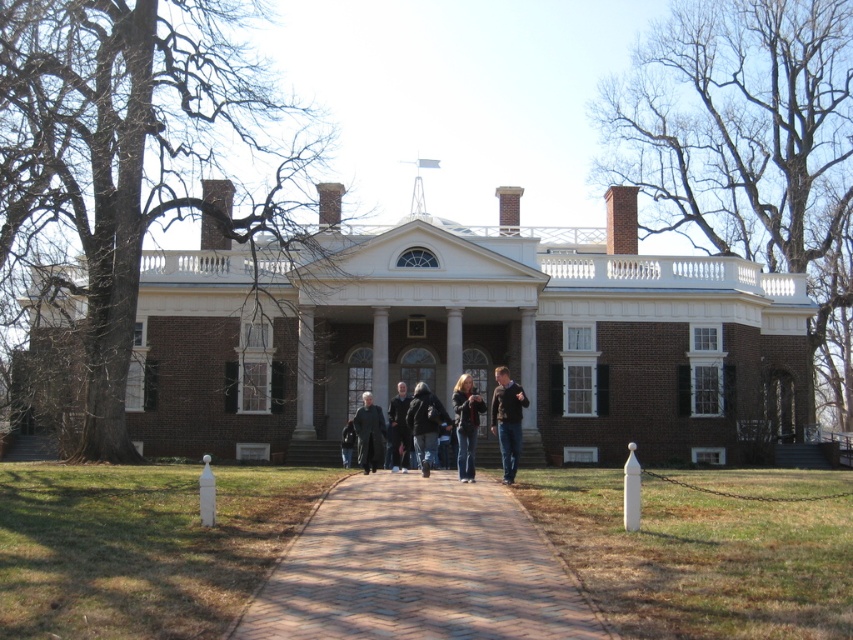
Is brick paved walkway at center above dark gray sweater at center?

Incorrect, brick paved walkway at center is not positioned above dark gray sweater at center.

In the scene shown: Is brick paved walkway at center taller than dark gray sweater at center?

In fact, brick paved walkway at center may be shorter than dark gray sweater at center.

Find the location of `brick paved walkway at center`. brick paved walkway at center is located at coordinates (x=419, y=568).

Can you confirm if brown brick building at center is bigger than dark gray sweater at center?

Correct, brown brick building at center is larger in size than dark gray sweater at center.

Which is more to the right, brown brick building at center or dark gray sweater at center?

Result: From the viewer's perspective, brown brick building at center appears more on the right side.

The image size is (853, 640). What do you see at coordinates (468, 340) in the screenshot?
I see `brown brick building at center` at bounding box center [468, 340].

Find the location of a particular element. brown brick building at center is located at coordinates (468, 340).

Who is positioned more to the left, brown brick building at center or denim jacket at center?

brown brick building at center

Between brown brick building at center and denim jacket at center, which one has less height?

denim jacket at center is shorter.

At what (x,y) coordinates should I click in order to perform the action: click on brown brick building at center. Please return your answer as a coordinate pair (x, y). This screenshot has width=853, height=640. Looking at the image, I should click on (468, 340).